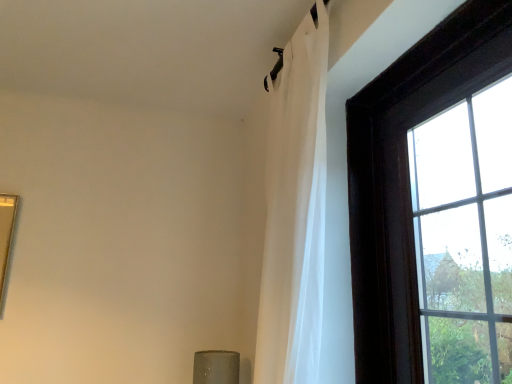
Image resolution: width=512 pixels, height=384 pixels. I want to click on dark wood frame at upper right, so click(x=406, y=178).

Describe the element at coordinates (406, 178) in the screenshot. This screenshot has width=512, height=384. I see `dark wood frame at upper right` at that location.

What is the approximate height of dark wood frame at upper right?

dark wood frame at upper right is 88.37 centimeters tall.

Describe the element at coordinates (295, 208) in the screenshot. The height and width of the screenshot is (384, 512). I see `white sheer curtain at upper right` at that location.

The height and width of the screenshot is (384, 512). In order to click on white sheer curtain at upper right in this screenshot , I will do `click(295, 208)`.

This screenshot has width=512, height=384. Identify the location of dark wood frame at upper right. (406, 178).

Consider the image. Can you confirm if dark wood frame at upper right is positioned to the left of white sheer curtain at upper right?

No.

Does dark wood frame at upper right lie in front of white sheer curtain at upper right?

Yes, it is.

Which is more distant, (383, 327) or (319, 265)?

Point (383, 327)

From the image's perspective, which is below, dark wood frame at upper right or white sheer curtain at upper right?

dark wood frame at upper right, from the image's perspective.

From the picture: From a real-world perspective, which object rests below the other?

dark wood frame at upper right, from a real-world perspective.

Does dark wood frame at upper right have a lesser width compared to white sheer curtain at upper right?

Correct, the width of dark wood frame at upper right is less than that of white sheer curtain at upper right.

Between dark wood frame at upper right and white sheer curtain at upper right, which one has less height?

dark wood frame at upper right.

Based on their sizes in the image, would you say dark wood frame at upper right is bigger or smaller than white sheer curtain at upper right?

Considering their sizes, dark wood frame at upper right takes up less space than white sheer curtain at upper right.

From the picture: Could white sheer curtain at upper right be considered to be inside dark wood frame at upper right?

No, white sheer curtain at upper right is located outside of dark wood frame at upper right.

Are dark wood frame at upper right and white sheer curtain at upper right beside each other?

No, dark wood frame at upper right is not beside white sheer curtain at upper right.

Could you tell me if dark wood frame at upper right is turned towards white sheer curtain at upper right?

Yes, dark wood frame at upper right is aimed at white sheer curtain at upper right.

How different are the orientations of dark wood frame at upper right and white sheer curtain at upper right in degrees?

0.00455 degrees separate the facing orientations of dark wood frame at upper right and white sheer curtain at upper right.

At what (x,y) coordinates should I click in order to perform the action: click on window on the right side of white sheer curtain at upper right. Please return your answer as a coordinate pair (x, y). This screenshot has width=512, height=384. Looking at the image, I should click on (406, 178).

Between white sheer curtain at upper right and dark wood frame at upper right, which one appears on the right side from the viewer's perspective?

dark wood frame at upper right.

Is the position of white sheer curtain at upper right less distant than that of dark wood frame at upper right?

No, it is behind dark wood frame at upper right.

Consider the image. Which is farther, (305, 21) or (367, 290)?

The point (305, 21) is farther from the camera.

From the image's perspective, between white sheer curtain at upper right and dark wood frame at upper right, who is located below?

dark wood frame at upper right appears lower in the image.

From a real-world perspective, relative to dark wood frame at upper right, is white sheer curtain at upper right vertically above or below?

In terms of real-world spatial position, white sheer curtain at upper right is above dark wood frame at upper right.

Is white sheer curtain at upper right wider than dark wood frame at upper right?

Correct, the width of white sheer curtain at upper right exceeds that of dark wood frame at upper right.

Between white sheer curtain at upper right and dark wood frame at upper right, which one has more height?

Standing taller between the two is white sheer curtain at upper right.

Considering the sizes of white sheer curtain at upper right and dark wood frame at upper right in the image, is white sheer curtain at upper right bigger or smaller than dark wood frame at upper right?

In the image, white sheer curtain at upper right appears to be larger than dark wood frame at upper right.

Is white sheer curtain at upper right situated inside dark wood frame at upper right or outside?

white sheer curtain at upper right is not enclosed by dark wood frame at upper right.

Is white sheer curtain at upper right next to dark wood frame at upper right?

white sheer curtain at upper right is not next to dark wood frame at upper right, and they're not touching.

Is white sheer curtain at upper right aimed at dark wood frame at upper right?

No, white sheer curtain at upper right is not aimed at dark wood frame at upper right.

Can you tell me how much white sheer curtain at upper right and dark wood frame at upper right differ in facing direction?

0.00455 degrees.

The image size is (512, 384). Find the location of `curtain on the left of the dark wood frame at upper right`. curtain on the left of the dark wood frame at upper right is located at coordinates (295, 208).

Image resolution: width=512 pixels, height=384 pixels. I want to click on curtain on the left of dark wood frame at upper right, so pos(295,208).

Find the location of a particular element. The width and height of the screenshot is (512, 384). window on the right of white sheer curtain at upper right is located at coordinates (406, 178).